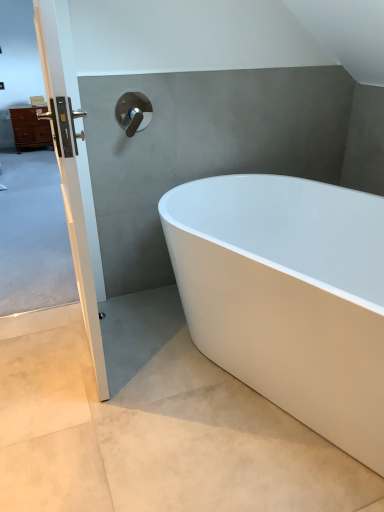
Question: From the image's perspective, does white smooth concrete at lower right appear higher than polished chrome faucet at upper center?

Choices:
 (A) yes
 (B) no

Answer: (B)

Question: Is white smooth concrete at lower right taller than polished chrome faucet at upper center?

Choices:
 (A) no
 (B) yes

Answer: (A)

Question: Is white smooth concrete at lower right in contact with polished chrome faucet at upper center?

Choices:
 (A) yes
 (B) no

Answer: (B)

Question: Does white smooth concrete at lower right appear on the left side of polished chrome faucet at upper center?

Choices:
 (A) yes
 (B) no

Answer: (B)

Question: Can we say white smooth concrete at lower right lies outside polished chrome faucet at upper center?

Choices:
 (A) yes
 (B) no

Answer: (A)

Question: From a real-world perspective, relative to white glossy bathtub at center, is white glossy door handle at left vertically above or below?

Choices:
 (A) above
 (B) below

Answer: (A)

Question: Considering the positions of white glossy door handle at left and white glossy bathtub at center in the image, is white glossy door handle at left wider or thinner than white glossy bathtub at center?

Choices:
 (A) wide
 (B) thin

Answer: (B)

Question: From the image's perspective, is white glossy door handle at left located above or below white glossy bathtub at center?

Choices:
 (A) below
 (B) above

Answer: (B)

Question: Is point (72, 169) closer or farther from the camera than point (170, 230)?

Choices:
 (A) closer
 (B) farther

Answer: (A)

Question: Do you think matte brown chest of drawers at left is within white glossy bathtub at center, or outside of it?

Choices:
 (A) outside
 (B) inside

Answer: (A)

Question: Visually, is matte brown chest of drawers at left positioned to the left or to the right of white glossy bathtub at center?

Choices:
 (A) left
 (B) right

Answer: (A)

Question: From a real-world perspective, is matte brown chest of drawers at left physically located above or below white glossy bathtub at center?

Choices:
 (A) below
 (B) above

Answer: (A)

Question: Considering the positions of point (44, 142) and point (364, 452), is point (44, 142) closer or farther from the camera than point (364, 452)?

Choices:
 (A) farther
 (B) closer

Answer: (A)

Question: Is white glossy bathtub at center bigger or smaller than white smooth concrete at lower right?

Choices:
 (A) big
 (B) small

Answer: (A)

Question: In terms of height, does white glossy bathtub at center look taller or shorter compared to white smooth concrete at lower right?

Choices:
 (A) short
 (B) tall

Answer: (B)